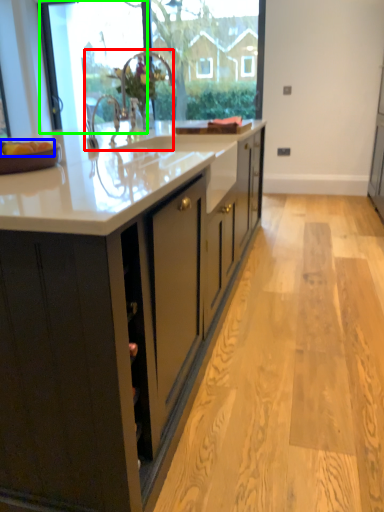
Question: Estimate the real-world distances between objects in this image. Which object is closer to sink (highlighted by a red box), apple (highlighted by a blue box) or glass door (highlighted by a green box)?

Choices:
 (A) apple
 (B) glass door

Answer: (B)